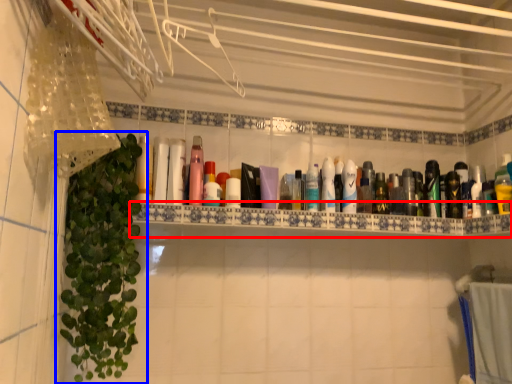
Question: Which of the following is the closest to the observer, shelve (highlighted by a red box) or houseplant (highlighted by a blue box)?

Choices:
 (A) shelve
 (B) houseplant

Answer: (B)